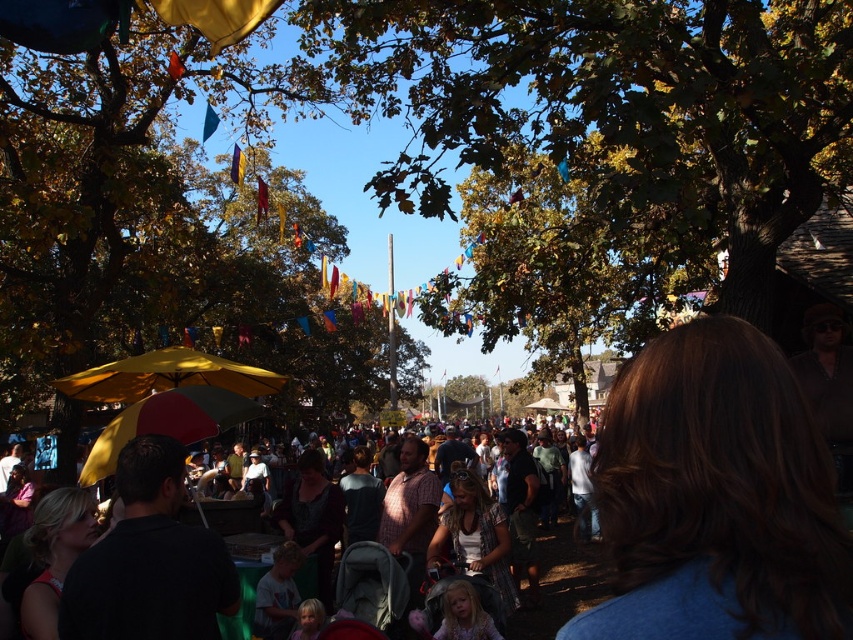
Question: Which point appears farthest from the camera in this image?

Choices:
 (A) click(x=508, y=632)
 (B) click(x=105, y=612)

Answer: (A)

Question: Does green leafy tree at center have a smaller size compared to dark brown hair at lower left?

Choices:
 (A) no
 (B) yes

Answer: (A)

Question: Can you confirm if brown hair at center is wider than yellow matte umbrella at center?

Choices:
 (A) no
 (B) yes

Answer: (A)

Question: Which point is closer to the camera?

Choices:
 (A) dark brown hair at lower left
 (B) brown hair at center
 (C) yellow matte umbrella at center
 (D) matte gray stroller at center

Answer: (B)

Question: Can you confirm if dark brown hair at lower left is positioned below matte gray stroller at center?

Choices:
 (A) no
 (B) yes

Answer: (A)

Question: Considering the real-world distances, which object is farthest from the green leafy tree at center?

Choices:
 (A) matte gray stroller at center
 (B) dark brown hair at lower left
 (C) yellow matte umbrella at center
 (D) brown hair at center

Answer: (D)